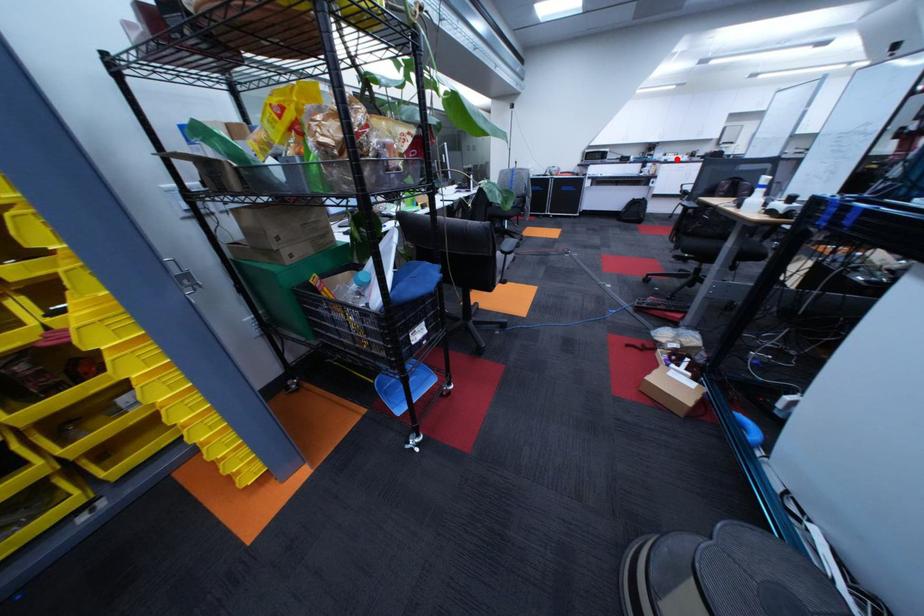
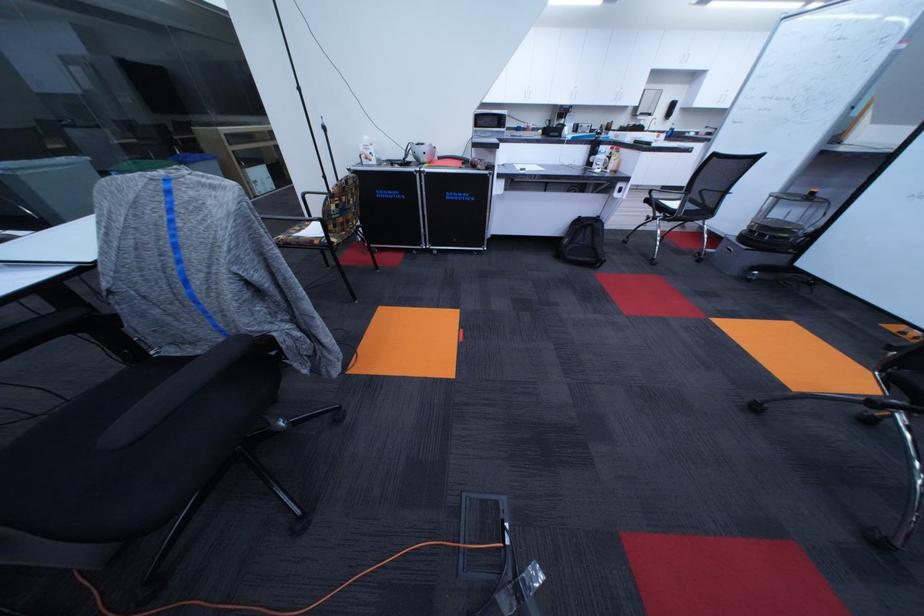
Question: I am providing you with two images of the same scene from different viewpoints. Given a red point in image1, look at the same physical point in image2. Is it:

Choices:
 (A) Closer to the viewpoint
 (B) Farther from the viewpoint

Answer: (B)